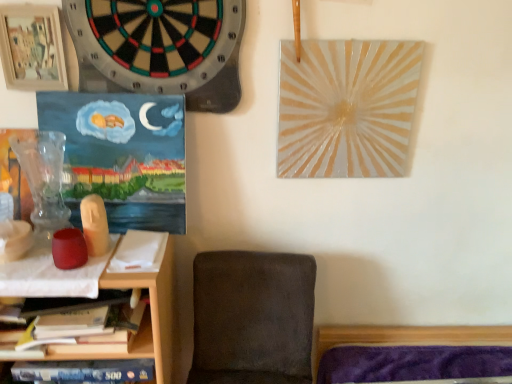
Question: Does point (167, 1) appear closer or farther from the camera than point (173, 329)?

Choices:
 (A) farther
 (B) closer

Answer: (B)

Question: From the image's perspective, relative to wooden shelf at lower left, is black felt dartboard at upper left above or below?

Choices:
 (A) below
 (B) above

Answer: (B)

Question: Estimate the real-world distances between objects in this image. Which object is farther from the black felt dartboard at upper left?

Choices:
 (A) wooden shelf at lower left
 (B) wooden picture frame at upper left
 (C) dark gray fabric chair at lower center

Answer: (C)

Question: Estimate the real-world distances between objects in this image. Which object is farther from the wooden picture frame at upper left?

Choices:
 (A) black felt dartboard at upper left
 (B) wooden shelf at lower left
 (C) dark gray fabric chair at lower center

Answer: (C)